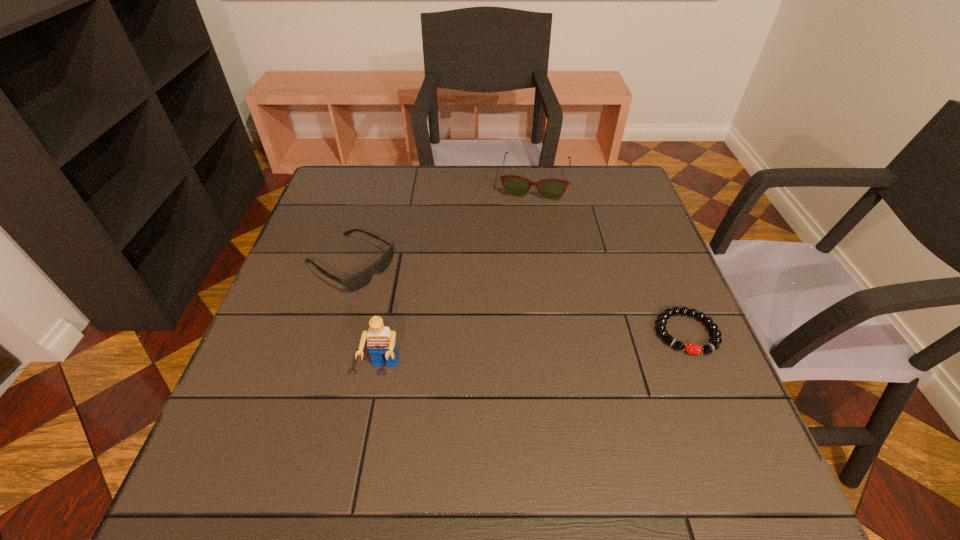
I want to click on free space on the desktop that is between the Lego and the shortest object and is positioned on the front-facing side of the sunglasses, so click(x=502, y=355).

Locate an element on the screen. free spot on the desktop that is between the Lego and the shortest object and is positioned at the front view of the spectacles is located at coordinates (513, 354).